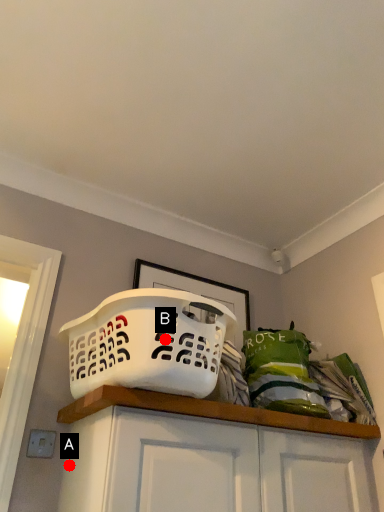
Question: Two points are circled on the image, labeled by A and B beside each circle. Which point appears farthest from the camera in this image?

Choices:
 (A) A is further
 (B) B is further

Answer: (A)